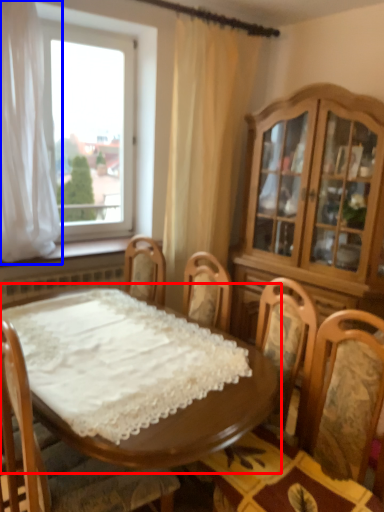
Question: Which object appears farthest to the camera in this image, table (highlighted by a red box) or curtain (highlighted by a blue box)?

Choices:
 (A) table
 (B) curtain

Answer: (B)